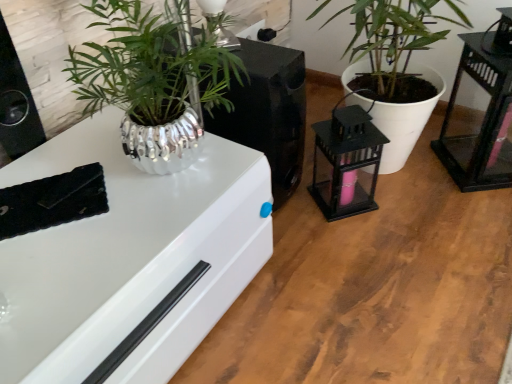
I want to click on vacant space to the right of black metal lantern at center-right, the first appliance in the right-to-left sequence, so click(x=406, y=199).